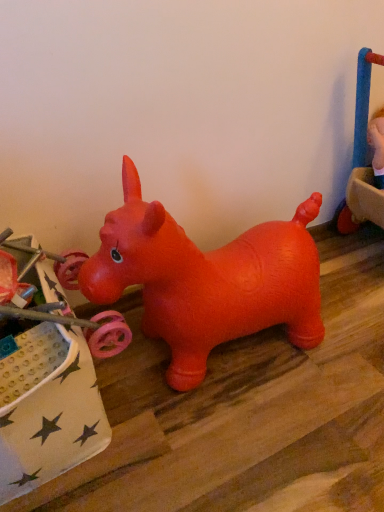
Question: Considering the relative positions of rubber dog at upper right, positioned as the second toy in left-to-right order, and rubber dog at center, marked as the 2th toy in a back-to-front arrangement, in the image provided, is rubber dog at upper right, positioned as the second toy in left-to-right order, to the left of rubber dog at center, marked as the 2th toy in a back-to-front arrangement, from the viewer's perspective?

Choices:
 (A) no
 (B) yes

Answer: (A)

Question: Is rubber dog at upper right, acting as the 1th toy starting from the top, behind rubber dog at center, marked as the 2th toy in a back-to-front arrangement?

Choices:
 (A) no
 (B) yes

Answer: (B)

Question: Is rubber dog at upper right, acting as the 2th toy starting from the front, in contact with rubber dog at center, the second toy viewed from the right?

Choices:
 (A) yes
 (B) no

Answer: (B)

Question: Could rubber dog at center, the second toy when ordered from top to bottom, be considered to be inside rubber dog at upper right, acting as the 2th toy starting from the front?

Choices:
 (A) no
 (B) yes

Answer: (A)

Question: Can you confirm if rubber dog at upper right, acting as the 1th toy starting from the top, is taller than rubber dog at center, the second toy viewed from the right?

Choices:
 (A) no
 (B) yes

Answer: (A)

Question: From the image's perspective, is rubber dog at upper right, which appears as the 1th toy when viewed from the right, above rubber dog at center, marked as the 2th toy in a back-to-front arrangement?

Choices:
 (A) yes
 (B) no

Answer: (A)

Question: Can you confirm if rubber dog at center, marked as the 2th toy in a back-to-front arrangement, is thinner than rubber dog at upper right, acting as the 1th toy starting from the top?

Choices:
 (A) no
 (B) yes

Answer: (A)

Question: Considering the relative sizes of rubber dog at center, the 1th toy in the left-to-right sequence, and rubber dog at upper right, acting as the 2th toy starting from the front, in the image provided, is rubber dog at center, the 1th toy in the left-to-right sequence, wider than rubber dog at upper right, acting as the 2th toy starting from the front,?

Choices:
 (A) yes
 (B) no

Answer: (A)

Question: Is rubber dog at center, the second toy when ordered from top to bottom, positioned far away from rubber dog at upper right, which appears as the 1th toy when viewed from the right?

Choices:
 (A) yes
 (B) no

Answer: (B)

Question: From the image's perspective, is rubber dog at center, which is counted as the 1th toy, starting from the front, on top of rubber dog at upper right, which appears as the 1th toy when viewed from the right?

Choices:
 (A) no
 (B) yes

Answer: (A)

Question: Is rubber dog at center, marked as the 2th toy in a back-to-front arrangement, to the right of rubber dog at upper right, positioned as the second toy in left-to-right order, from the viewer's perspective?

Choices:
 (A) yes
 (B) no

Answer: (B)

Question: Is rubber dog at center, the 1th toy in the left-to-right sequence, positioned with its back to rubber dog at upper right, positioned as the second toy in left-to-right order?

Choices:
 (A) no
 (B) yes

Answer: (A)

Question: Is point (365, 159) closer or farther from the camera than point (79, 394)?

Choices:
 (A) farther
 (B) closer

Answer: (A)